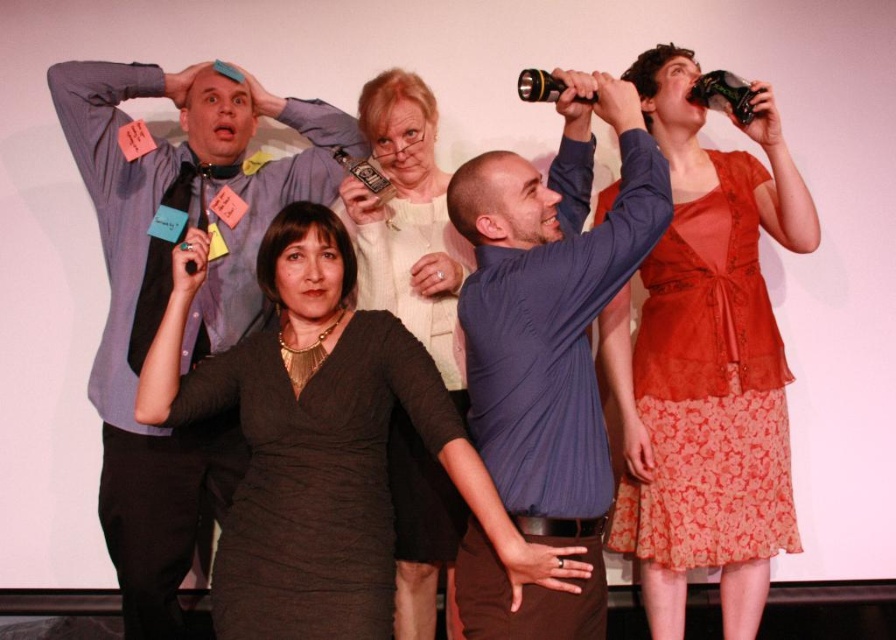
Is point (660, 497) closer to viewer compared to point (464, 412)?

That is False.

Which is below, matte orange blouse at upper right or matte white sweater at center?

Positioned lower is matte white sweater at center.

Does point (632, 380) lie in front of point (390, 298)?

No, (632, 380) is behind (390, 298).

This screenshot has width=896, height=640. Find the location of `matte orange blouse at upper right`. matte orange blouse at upper right is located at coordinates (705, 362).

Which of these two, matte black shirt at left or matte white sweater at center, stands taller?

With more height is matte white sweater at center.

Which is below, matte black shirt at left or matte white sweater at center?

matte white sweater at center is lower down.

Describe the element at coordinates (169, 292) in the screenshot. The height and width of the screenshot is (640, 896). I see `matte black shirt at left` at that location.

Find the location of a particular element. matte black shirt at left is located at coordinates (169, 292).

Is point (286, 317) farther from camera compared to point (418, 609)?

No.

Is point (257, 580) closer to camera compared to point (360, 260)?

That is True.

Where is `matte black dress at center`? Image resolution: width=896 pixels, height=640 pixels. matte black dress at center is located at coordinates (321, 444).